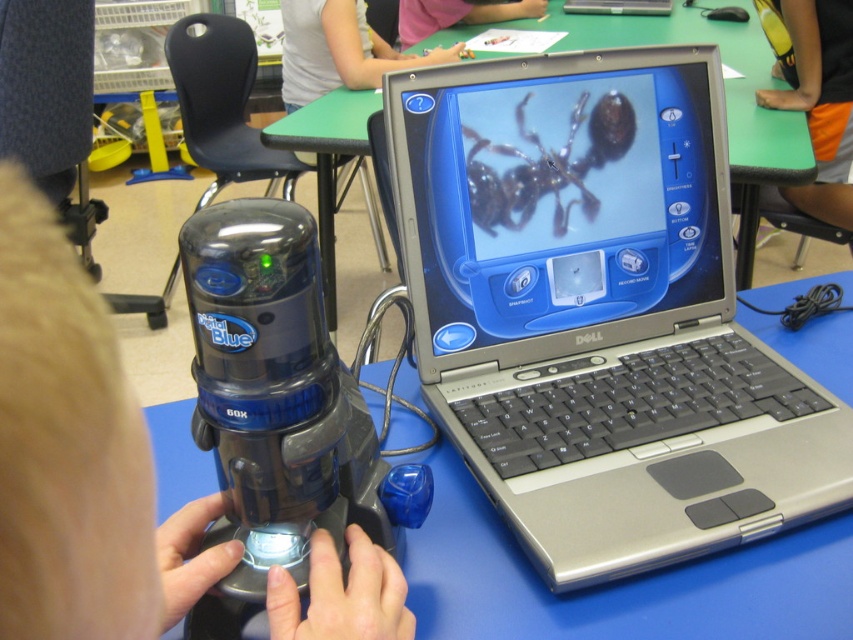
Can you confirm if silver/black plastic laptop at center is shorter than pink fabric shirt at upper center?

In fact, silver/black plastic laptop at center may be taller than pink fabric shirt at upper center.

Describe the element at coordinates (598, 310) in the screenshot. I see `silver/black plastic laptop at center` at that location.

In order to click on silver/black plastic laptop at center in this screenshot , I will do `click(598, 310)`.

Can you confirm if silver/black plastic laptop at center is shorter than transparent plastic blender at center?

In fact, silver/black plastic laptop at center may be taller than transparent plastic blender at center.

Locate an element on the screen. The height and width of the screenshot is (640, 853). silver/black plastic laptop at center is located at coordinates (598, 310).

Between point (428, 205) and point (274, 240), which one is positioned behind?

The point (428, 205) is behind.

Where is `silver/black plastic laptop at center`? The image size is (853, 640). silver/black plastic laptop at center is located at coordinates (598, 310).

Can you confirm if blue plastic table at center is taller than shiny black spider at center?

Correct, blue plastic table at center is much taller as shiny black spider at center.

Which is in front, point (817, 534) or point (531, 168)?

Point (817, 534)

Does point (477, 548) lie in front of point (595, 202)?

Yes, point (477, 548) is in front of point (595, 202).

At what (x,y) coordinates should I click in order to perform the action: click on blue plastic table at center. Please return your answer as a coordinate pair (x, y). The image size is (853, 640). Looking at the image, I should click on tap(618, 580).